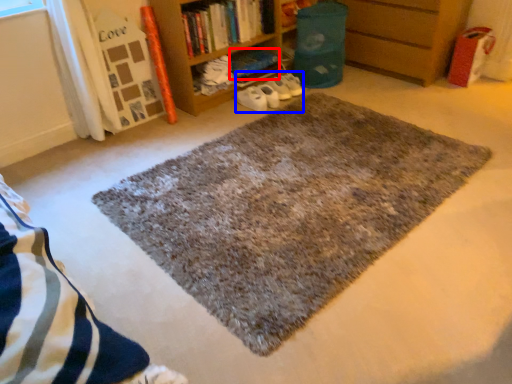
Question: Which object is further to the camera taking this photo, book (highlighted by a red box) or shoe (highlighted by a blue box)?

Choices:
 (A) book
 (B) shoe

Answer: (A)